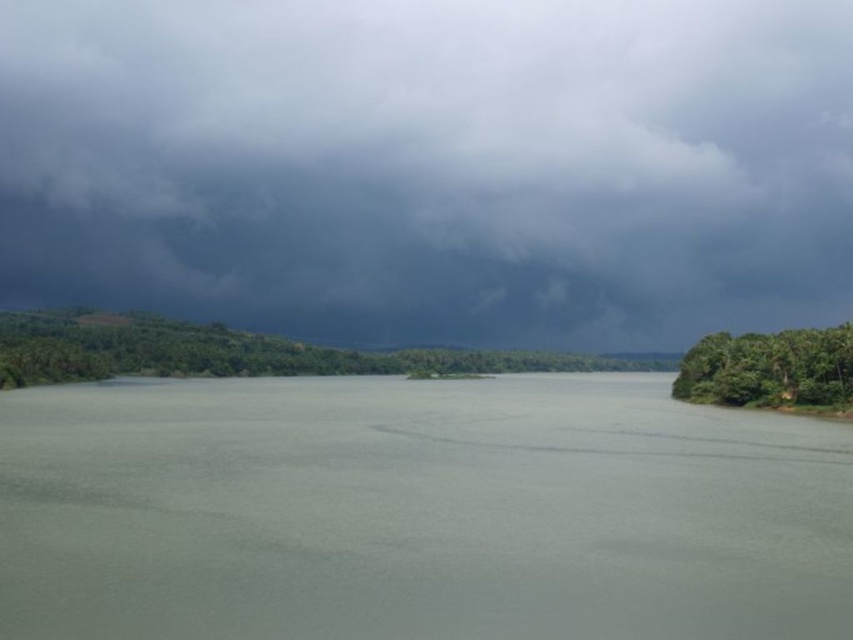
You are an environmental scientist assessing the scene. Based on the image, which object occupies a larger area in the scene between the dark gray cloud at upper center and the green leafy trees at center?

The dark gray cloud at upper center is larger in size than the green leafy trees at center, so it occupies a larger area in the scene.

Looking at this image, you are standing at the lakeside and notice the dark gray cloud at upper center and the green leafy trees at center. Which one appears taller from your perspective?

The dark gray cloud at upper center appears taller than the green leafy trees at center because it has a greater height compared to them.

You are standing at the point with coordinates 0.5,0.5. You want to reach the gray matte water at center. In which direction should you move?

You should move northeast to reach the gray matte water at center located at point (416, 512) from your current position at (426, 320).